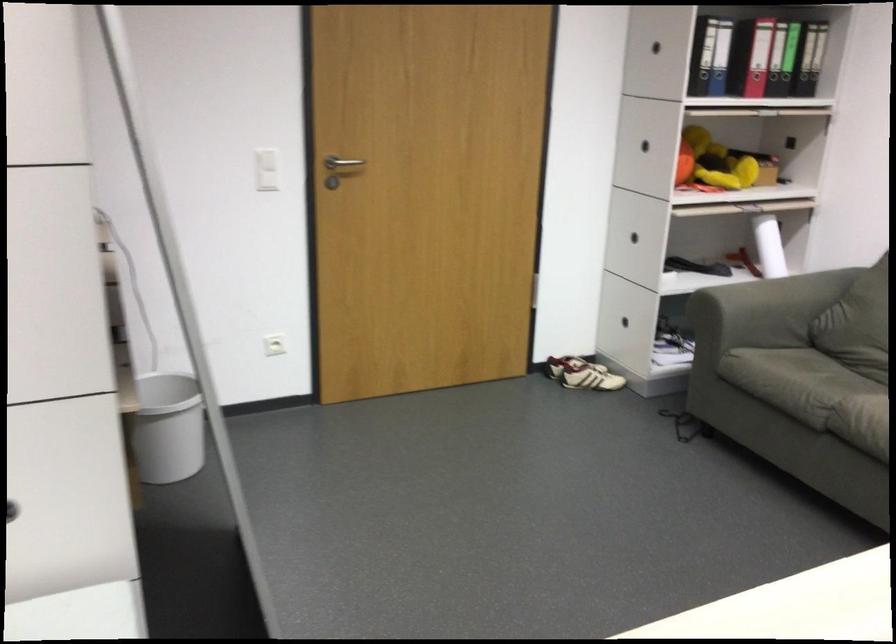
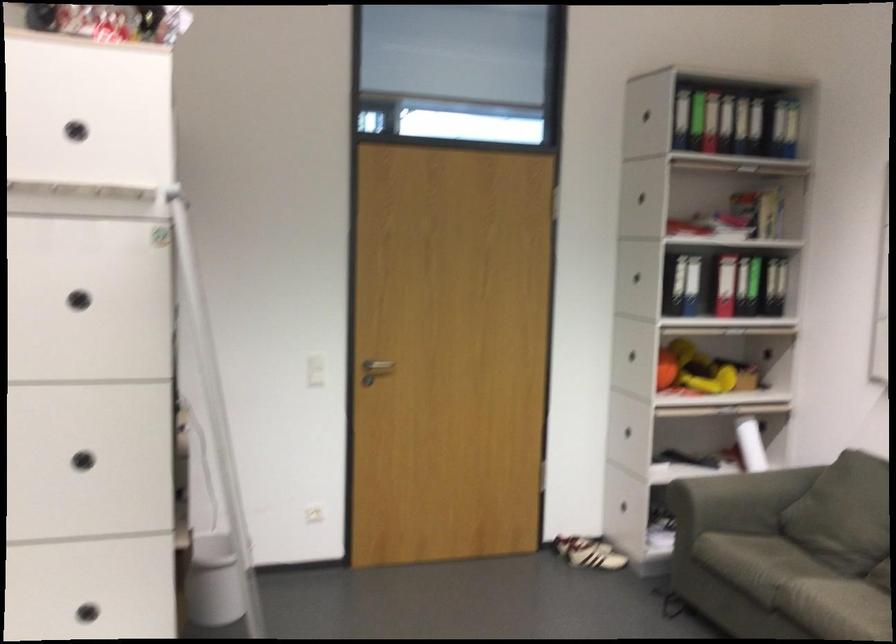
Locate, in the second image, the point that corresponds to point 825,440 in the first image.

(771, 623)